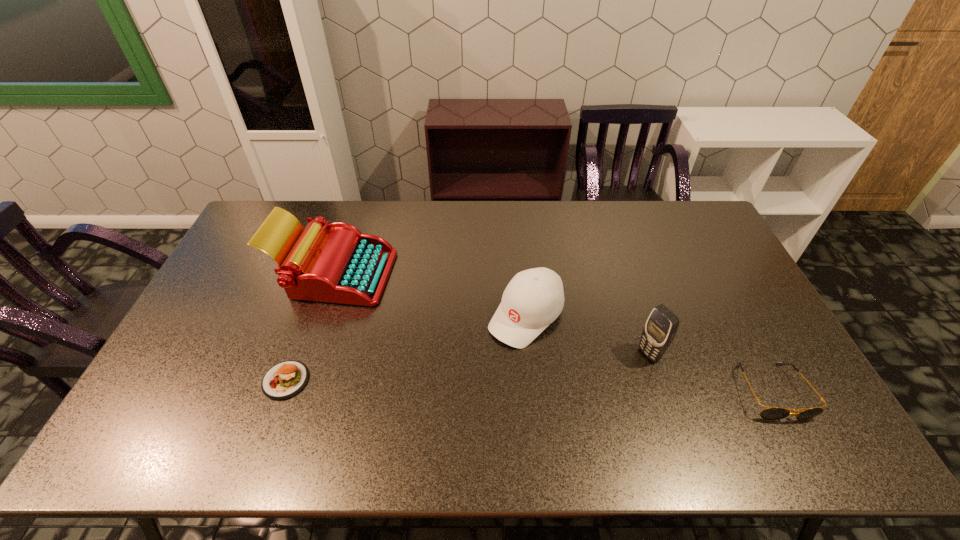
Find the location of a particular element. The width and height of the screenshot is (960, 540). vacant area located on the front face of the fourth object from left to right is located at coordinates (569, 400).

Identify the location of vacant space located 0.260m on the front-facing side of the third object from right to left. tap(440, 406).

This screenshot has width=960, height=540. I want to click on vacant space situated 0.110m on the front-facing side of the third object from right to left, so point(478,367).

Locate an element on the screen. Image resolution: width=960 pixels, height=540 pixels. free space located on the front-facing side of the third object from right to left is located at coordinates (492, 353).

Locate an element on the screen. The height and width of the screenshot is (540, 960). vacant space positioned 0.360m on the typing side of the typewriter is located at coordinates (470, 346).

In order to click on free spot located on the typing side of the typewriter in this screenshot , I will do `click(412, 312)`.

This screenshot has width=960, height=540. In order to click on vacant space located on the typing side of the typewriter in this screenshot , I will do `click(393, 300)`.

Locate an element on the screen. object situated at the far edge is located at coordinates (343, 265).

I want to click on patty (food) at the near edge, so click(284, 380).

The image size is (960, 540). Find the location of `sunglasses located at the near edge`. sunglasses located at the near edge is located at coordinates (771, 413).